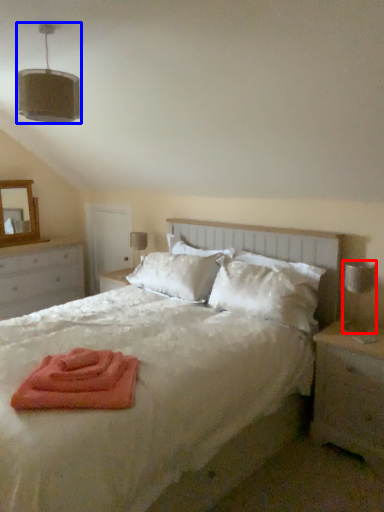
Question: Which object appears farthest to the camera in this image, table lamp (highlighted by a red box) or light fixture (highlighted by a blue box)?

Choices:
 (A) table lamp
 (B) light fixture

Answer: (A)